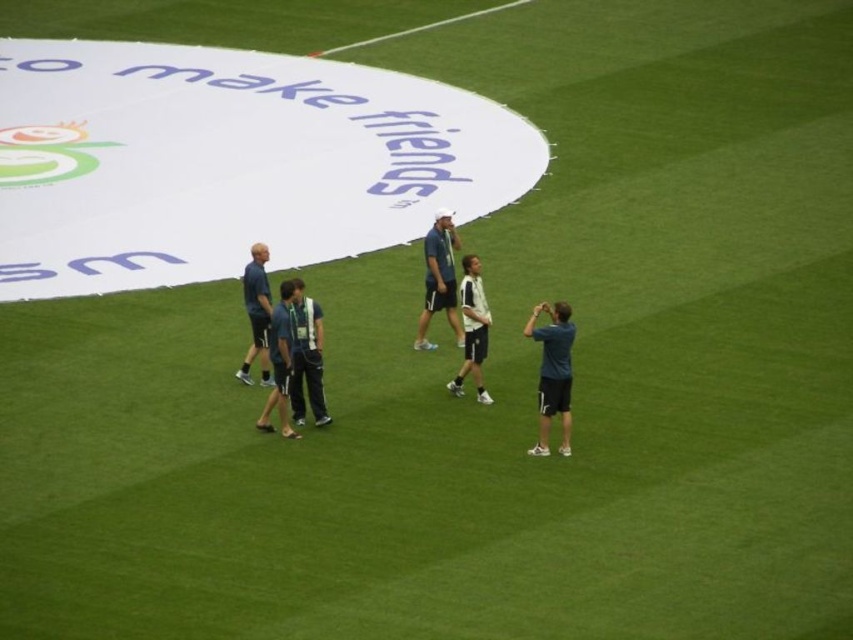
Question: Does light blue fabric shirt at center appear on the left side of dark blue jersey at center?

Choices:
 (A) no
 (B) yes

Answer: (A)

Question: Where is dark blue fabric at center located in relation to white matte jacket at center in the image?

Choices:
 (A) left
 (B) right

Answer: (A)

Question: Which point is closer to the camera?

Choices:
 (A) (416, 339)
 (B) (262, 360)
 (C) (548, 380)

Answer: (C)

Question: Can you confirm if light blue fabric shirt at center is thinner than dark blue jersey at center?

Choices:
 (A) yes
 (B) no

Answer: (B)

Question: Estimate the real-world distances between objects in this image. Which object is closer to the dark blue fabric shirt at center?

Choices:
 (A) dark blue fabric at center
 (B) dark blue shorts at lower right
 (C) white matte jacket at center
 (D) light blue fabric shirt at center

Answer: (A)

Question: Which of the following is the closest to the observer?

Choices:
 (A) (271, 388)
 (B) (541, 362)
 (C) (427, 305)

Answer: (B)